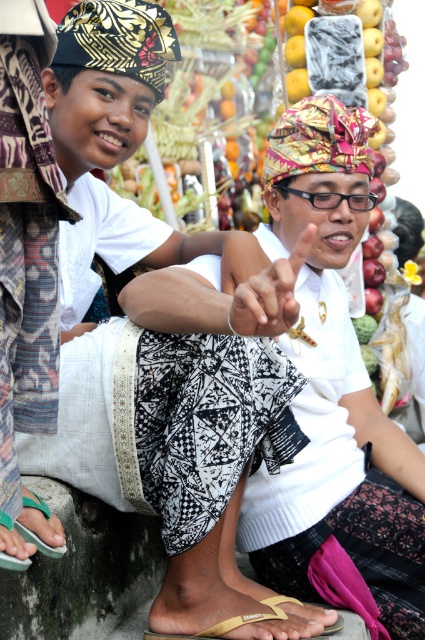
You are standing in front of the scene and want to pick up the closest sandal to you. Which one should you choose between the yellow fabric sandal at lower center and the gold textured sandal at lower center?

The yellow fabric sandal at lower center is closer to the viewer than the gold textured sandal at lower center, so you should choose the yellow fabric sandal at lower center.